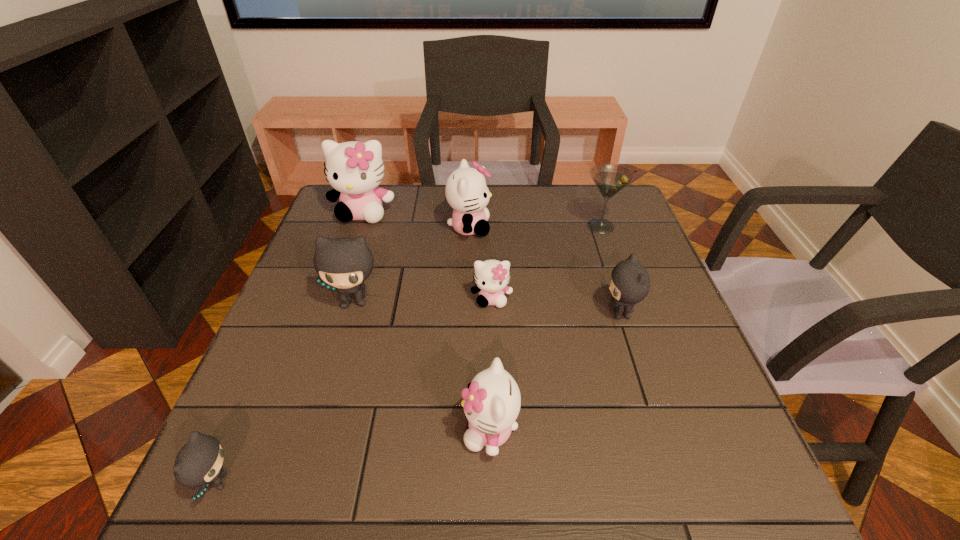
Identify which gray kitten is the second closest to the second gray kitten from left to right. Please provide its 2D coordinates. Your answer should be formatted as a tuple, i.e. [(x, y)], where the tuple contains the x and y coordinates of a point satisfying the conditions above.

[(629, 284)]

Where is `gray kitten object that ranks as the third closest to the second nearest white kitten`? This screenshot has height=540, width=960. gray kitten object that ranks as the third closest to the second nearest white kitten is located at coordinates (199, 462).

Identify the location of vacant region that satisfies the following two spatial constraints: 1. on the front side of the martini; 2. on the front-facing side of the smallest gray kitten. (689, 482).

Locate an element on the screen. Image resolution: width=960 pixels, height=540 pixels. free point that satisfies the following two spatial constraints: 1. on the front-facing side of the martini; 2. on the right side of the leftmost white kitten is located at coordinates (358, 226).